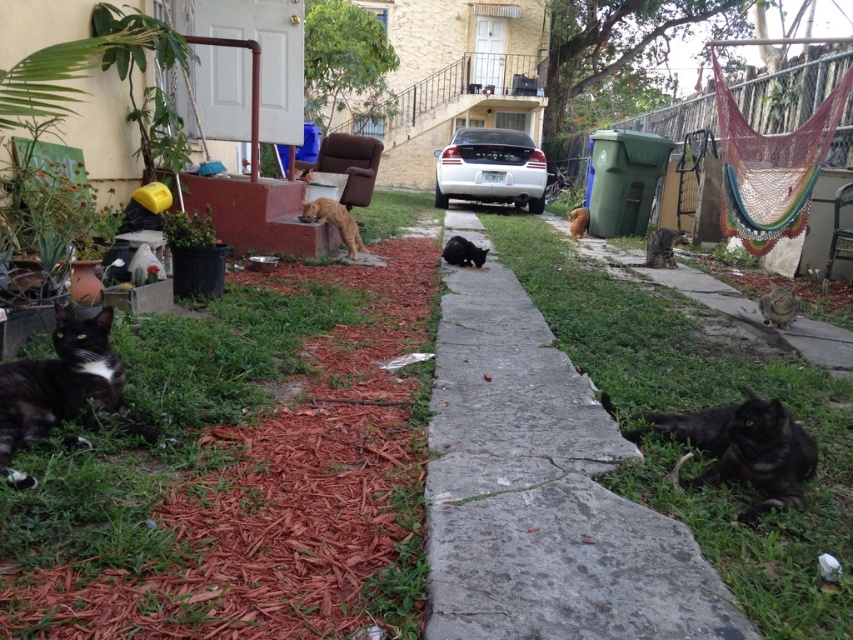
You are a photographer trying to capture the black fur cat at lower left. The camera you have can only focus on objects within a 0.1 unit radius around the point specified. Is the black fur cat at lower left within the focus range of the camera set to point (64,388)?

The point (64,388) indicates the black fur cat at lower left, so yes, the camera will focus on the black fur cat at lower left as it is exactly at the specified point.

You are a cat owner who wants to buy a cat bed for both the black fur cat at center and the brown fur cat at center. Based on their sizes, which cat bed should you choose for each?

The black fur cat at center is larger in width than the brown fur cat at center, so you should choose a larger cat bed for the black fur cat at center and a smaller one for the brown fur cat at center.